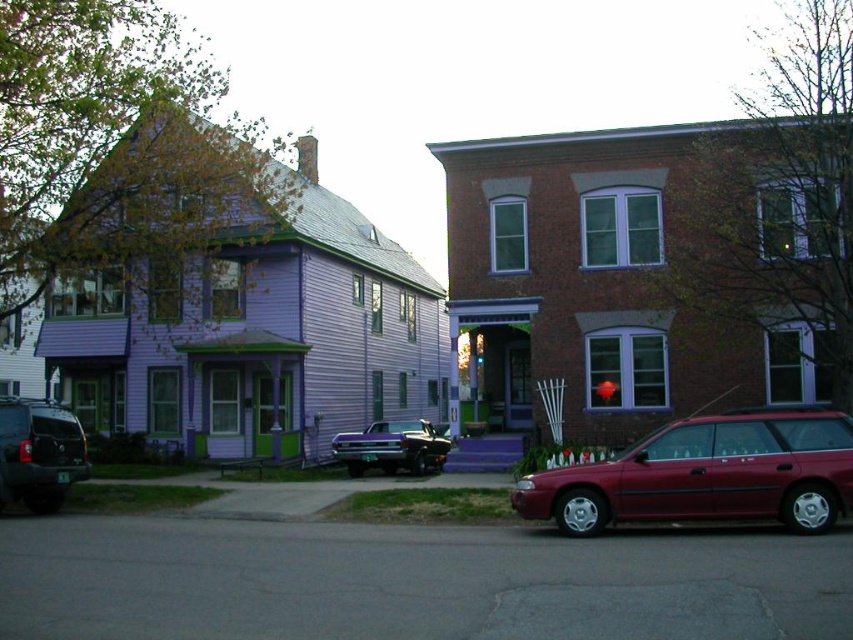
Can you confirm if metallic red station wagon at lower right is positioned below metallic red traffic light at center?

Yes.

Is metallic red station wagon at lower right above metallic red traffic light at center?

No.

Does point (548, 518) come closer to viewer compared to point (482, 356)?

Yes, it is in front of point (482, 356).

At what (x,y) coordinates should I click in order to perform the action: click on metallic red station wagon at lower right. Please return your answer as a coordinate pair (x, y). The image size is (853, 640). Looking at the image, I should click on (706, 474).

This screenshot has width=853, height=640. What do you see at coordinates (39, 452) in the screenshot?
I see `matte black suv at lower left` at bounding box center [39, 452].

Who is more forward, (x=45, y=461) or (x=364, y=458)?

Point (x=45, y=461) is in front.

The width and height of the screenshot is (853, 640). What do you see at coordinates (39, 452) in the screenshot?
I see `matte black suv at lower left` at bounding box center [39, 452].

Where is `matte black suv at lower left`? matte black suv at lower left is located at coordinates (39, 452).

Is point (432, 428) positioned in front of point (479, 356)?

Yes, point (432, 428) is closer to viewer.

Can you confirm if shiny purple car at center is bigger than metallic red traffic light at center?

Incorrect, shiny purple car at center is not larger than metallic red traffic light at center.

Who is more distant from viewer, (361, 461) or (479, 364)?

Point (479, 364)

Locate an element on the screen. This screenshot has height=640, width=853. shiny purple car at center is located at coordinates (392, 448).